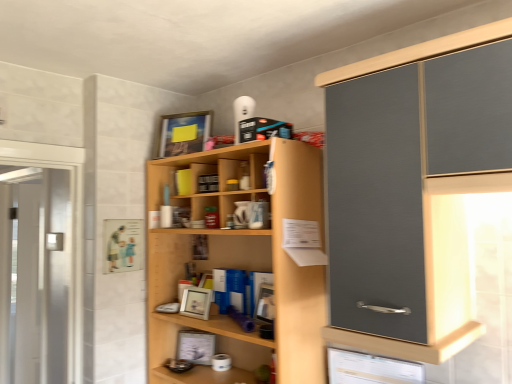
Question: From their relative heights in the image, would you say metallic silver picture frame at lower center, the third picture frame positioned from the top, is taller or shorter than transparent glass screen door at left?

Choices:
 (A) tall
 (B) short

Answer: (B)

Question: Looking at their shapes, would you say metallic silver picture frame at lower center, the third picture frame positioned from the top, is wider or thinner than transparent glass screen door at left?

Choices:
 (A) wide
 (B) thin

Answer: (B)

Question: Based on their relative distances, which object is farther from the white matte picture frame at center, which ranks as the 2th picture frame in top-to-bottom order?

Choices:
 (A) light wood cupboard at center
 (B) matte wooden picture frame at upper center, placed as the third picture frame when sorted from bottom to top
 (C) transparent glass screen door at left
 (D) metallic silver picture frame at lower center, the third picture frame positioned from the top

Answer: (C)

Question: Which object is the farthest from the light wood cupboard at center?

Choices:
 (A) white matte picture frame at center, which ranks as the 2th picture frame in top-to-bottom order
 (B) transparent glass screen door at left
 (C) matte wooden picture frame at upper center, placed as the third picture frame when sorted from bottom to top
 (D) metallic silver picture frame at lower center, which appears as the first picture frame when ordered from the bottom

Answer: (B)